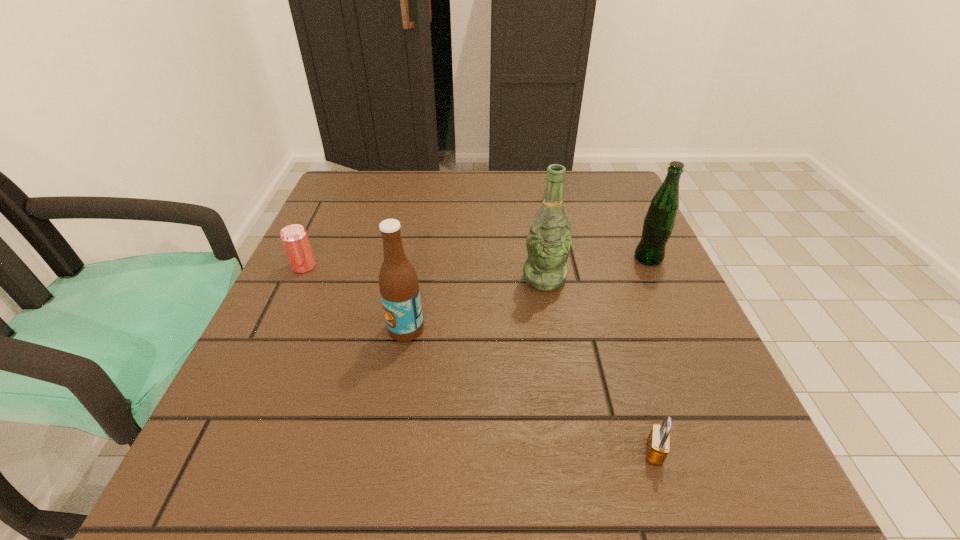
You are a GUI agent. You are given a task and a screenshot of the screen. Output one action in this format:
    pyautogui.click(x=<x>, y=<y>)
    Task: Click on the second beer bottle from right to left
    The height and width of the screenshot is (540, 960).
    Given the screenshot: What is the action you would take?
    pyautogui.click(x=549, y=241)

Identify the location of the second nearest object. (399, 288).

At what (x,y) coordinates should I click in order to perform the action: click on the leftmost beer bottle. Please return your answer as a coordinate pair (x, y). Looking at the image, I should click on (399, 288).

You are a GUI agent. You are given a task and a screenshot of the screen. Output one action in this format:
    pyautogui.click(x=<x>, y=<y>)
    Task: Click on the rightmost object
    The image size is (960, 540).
    Given the screenshot: What is the action you would take?
    pyautogui.click(x=659, y=222)

Where is `the leftmost object`? This screenshot has width=960, height=540. the leftmost object is located at coordinates click(x=294, y=237).

Locate an element on the screen. Image resolution: width=960 pixels, height=540 pixels. the nearest object is located at coordinates (658, 442).

At what (x,y) coordinates should I click in order to perform the action: click on padlock. Please return your answer as a coordinate pair (x, y). The width and height of the screenshot is (960, 540). Looking at the image, I should click on (658, 442).

The height and width of the screenshot is (540, 960). Identify the location of free location located 0.130m on the surface of the third object from left to right. (555, 344).

Identify the location of free space located on the left of the leftmost beer bottle. (267, 329).

This screenshot has height=540, width=960. Identify the location of vacant space located 0.250m on the left of the rightmost object. coord(518,258).